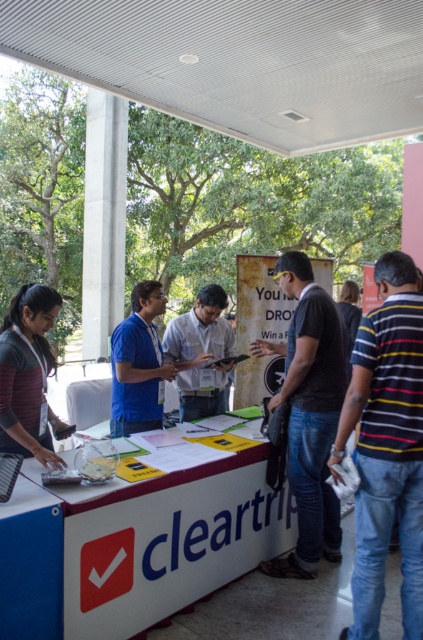
Between white plastic table at center and concrete column at center, which one appears on the left side from the viewer's perspective?

concrete column at center

Between white plastic table at center and concrete column at center, which one has more height?

concrete column at center is taller.

The image size is (423, 640). In order to click on white plastic table at center in this screenshot , I will do `click(134, 547)`.

This screenshot has width=423, height=640. Identify the location of white plastic table at center. (134, 547).

Consider the image. Does white plastic table at center come behind blue matte shirt at center?

No, it is not.

Does white plastic table at center have a lesser height compared to blue matte shirt at center?

Indeed, white plastic table at center has a lesser height compared to blue matte shirt at center.

This screenshot has height=640, width=423. In order to click on white plastic table at center in this screenshot , I will do `click(134, 547)`.

You are a GUI agent. You are given a task and a screenshot of the screen. Output one action in this format:
    pyautogui.click(x=<x>, y=<y>)
    Task: Click on the white plastic table at center
    This screenshot has height=640, width=423.
    Given the screenshot: What is the action you would take?
    pyautogui.click(x=134, y=547)

Can you confirm if white plastic table at center is wider than light gray shirt at center?

Yes.

Does white plastic table at center have a smaller size compared to light gray shirt at center?

Actually, white plastic table at center might be larger than light gray shirt at center.

I want to click on white plastic table at center, so click(134, 547).

Where is `white plastic table at center`? white plastic table at center is located at coordinates (134, 547).